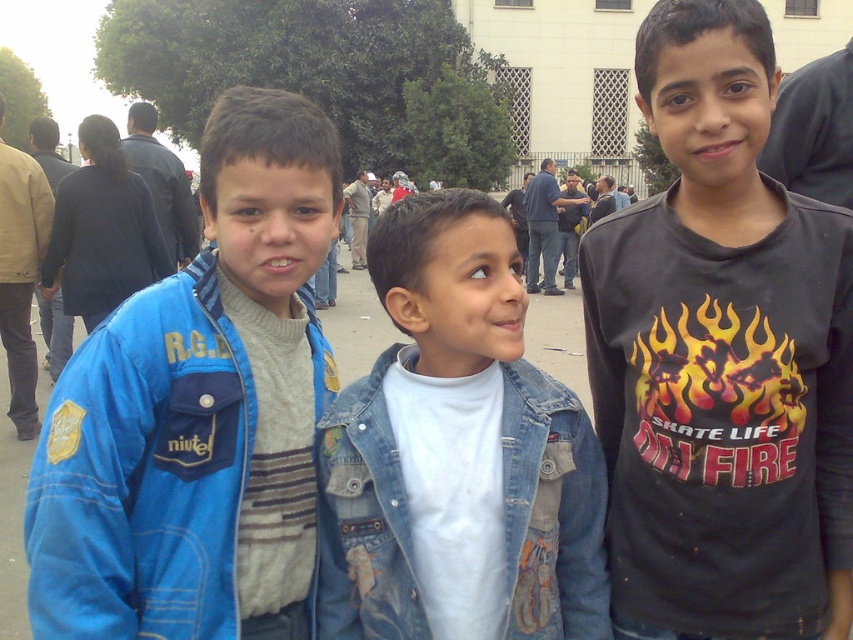
You are trying to decide which jacket to take for a quick walk. You see the brushed denim jacket at left and the dark blue jacket at upper left. Which one has a wider width?

The brushed denim jacket at left is wider than the dark blue jacket at upper left according to the description.